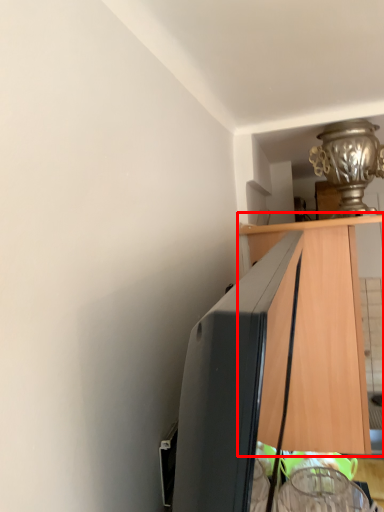
Question: Observing the image, what is the correct spatial positioning of cabinetry (annotated by the red box) in reference to lamp?

Choices:
 (A) left
 (B) right

Answer: (B)